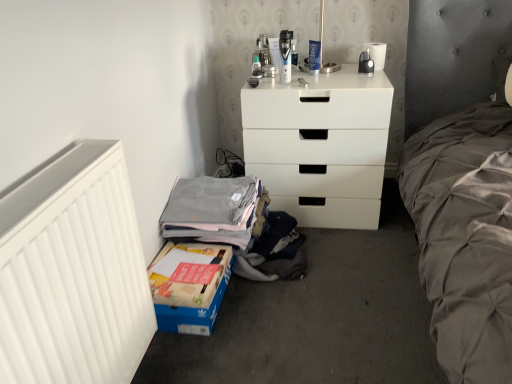
Where is `free space behind matte plastic shaver at upper center`? This screenshot has width=512, height=384. free space behind matte plastic shaver at upper center is located at coordinates (283, 77).